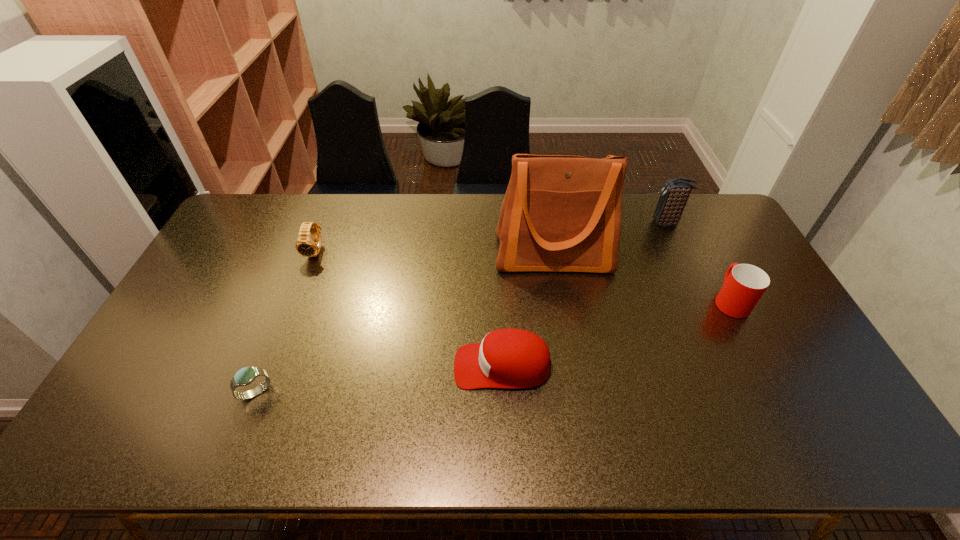
Locate an element on the screen. The height and width of the screenshot is (540, 960). empty space between the taller watch and the baseball cap is located at coordinates pos(409,309).

The height and width of the screenshot is (540, 960). In order to click on vacant space in between the shortest object and the tallest object in this screenshot , I will do `click(405, 323)`.

You are a GUI agent. You are given a task and a screenshot of the screen. Output one action in this format:
    pyautogui.click(x=<x>, y=<y>)
    Task: Click on the empty space between the cup and the baseball cap
    This screenshot has width=960, height=540.
    Given the screenshot: What is the action you would take?
    pyautogui.click(x=616, y=333)

Where is `free space between the shortest object and the baseball cap`? This screenshot has height=540, width=960. free space between the shortest object and the baseball cap is located at coordinates (379, 379).

Where is `free spot between the tallest object and the cup`? This screenshot has width=960, height=540. free spot between the tallest object and the cup is located at coordinates (642, 278).

Locate an element on the screen. This screenshot has height=540, width=960. free space that is in between the fifth shortest object and the farther watch is located at coordinates (492, 238).

Locate which object is the second closest to the fourth farthest object. Please provide its 2D coordinates. Your answer should be formatted as a tuple, i.e. [(x, y)], where the tuple contains the x and y coordinates of a point satisfying the conditions above.

[(674, 195)]

At what (x,y) coordinates should I click in order to perform the action: click on the second closest object relative to the farther watch. Please return your answer as a coordinate pair (x, y). The height and width of the screenshot is (540, 960). Looking at the image, I should click on (510, 358).

Where is `vacant point that satisfies the following two spatial constraints: 1. on the side of the third nearest object with the handle; 2. with the zip open on the clutch bag`? The width and height of the screenshot is (960, 540). vacant point that satisfies the following two spatial constraints: 1. on the side of the third nearest object with the handle; 2. with the zip open on the clutch bag is located at coordinates (690, 224).

Where is `free location that satisfies the following two spatial constraints: 1. on the face of the farther watch; 2. on the right side of the shopping bag`? The width and height of the screenshot is (960, 540). free location that satisfies the following two spatial constraints: 1. on the face of the farther watch; 2. on the right side of the shopping bag is located at coordinates (315, 255).